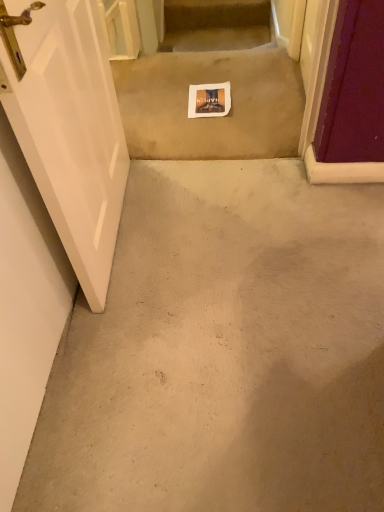
Question: Considering the positions of carpeted stairs at upper center and white glossy door at left in the image, is carpeted stairs at upper center bigger or smaller than white glossy door at left?

Choices:
 (A) big
 (B) small

Answer: (B)

Question: Considering the positions of point (238, 14) and point (91, 176), is point (238, 14) closer or farther from the camera than point (91, 176)?

Choices:
 (A) farther
 (B) closer

Answer: (A)

Question: Based on their relative distances, which object is nearer to the white glossy door at left?

Choices:
 (A) carpeted stairs at upper center
 (B) white paper at center
 (C) beige carpet at center

Answer: (C)

Question: Estimate the real-world distances between objects in this image. Which object is farther from the carpeted stairs at upper center?

Choices:
 (A) white paper at center
 (B) beige carpet at center
 (C) white glossy door at left

Answer: (C)